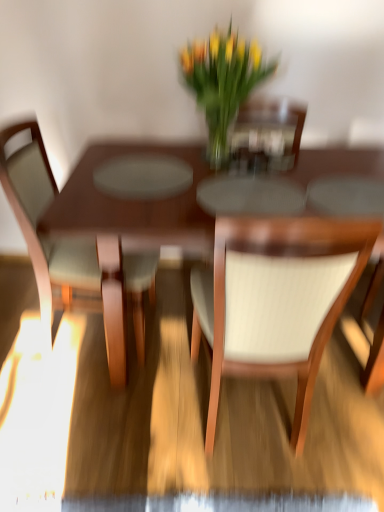
What do you see at coordinates (71, 251) in the screenshot?
I see `light brown wood chair at left, the second chair from the right` at bounding box center [71, 251].

This screenshot has height=512, width=384. I want to click on wooden table at center, so click(128, 227).

Where is `white textured chair at center, the 1th chair in the right-to-left sequence`? Image resolution: width=384 pixels, height=512 pixels. white textured chair at center, the 1th chair in the right-to-left sequence is located at coordinates (276, 300).

Is point (352, 240) less distant than point (154, 282)?

That is True.

Consider the image. From a real-world perspective, which object stands above the other?

light brown wood chair at left, the second chair from the right.

From the image's perspective, is white textured chair at center, the 1th chair in the right-to-left sequence, beneath light brown wood chair at left, the second chair from the right?

Correct, white textured chair at center, the 1th chair in the right-to-left sequence, appears lower than light brown wood chair at left, the second chair from the right, in the image.

Would you say light brown wood chair at left, the second chair from the right, is to the left or to the right of white textured chair at center, which appears as the second chair when viewed from the left, in the picture?

light brown wood chair at left, the second chair from the right, is to the left of white textured chair at center, which appears as the second chair when viewed from the left.

Is light brown wood chair at left, the second chair from the right, further to camera compared to white textured chair at center, which appears as the second chair when viewed from the left?

That is True.

Looking at the image, does light brown wood chair at left, marked as the first chair in a left-to-right arrangement, seem bigger or smaller compared to white textured chair at center, the 1th chair in the right-to-left sequence?

Clearly, light brown wood chair at left, marked as the first chair in a left-to-right arrangement, is larger in size than white textured chair at center, the 1th chair in the right-to-left sequence.

At what (x,y) coordinates should I click in order to perform the action: click on chair in front of the light brown wood chair at left, the second chair from the right. Please return your answer as a coordinate pair (x, y). The image size is (384, 512). Looking at the image, I should click on (276, 300).

From the image's perspective, which is above, translucent glass vase at center or light brown wood chair at left, the second chair from the right?

translucent glass vase at center, from the image's perspective.

From a real-world perspective, is translucent glass vase at center positioned under light brown wood chair at left, the second chair from the right, based on gravity?

No, from a real-world perspective, translucent glass vase at center is not beneath light brown wood chair at left, the second chair from the right.

Is translucent glass vase at center next to light brown wood chair at left, the second chair from the right, and touching it?

No, translucent glass vase at center is not with light brown wood chair at left, the second chair from the right.

Consider the image. Does translucent glass vase at center have a greater height compared to light brown wood chair at left, the second chair from the right?

No.

Can you confirm if wooden table at center is smaller than translucent glass vase at center?

Incorrect, wooden table at center is not smaller in size than translucent glass vase at center.

Considering their positions, is wooden table at center located in front of or behind translucent glass vase at center?

wooden table at center is in front of translucent glass vase at center.

From the image's perspective, is wooden table at center under translucent glass vase at center?

Indeed, from the image's perspective, wooden table at center is shown beneath translucent glass vase at center.

Which of these two, wooden table at center or translucent glass vase at center, is wider?

With larger width is wooden table at center.

Does white textured chair at center, the 1th chair in the right-to-left sequence, have a lesser width compared to wooden table at center?

Yes, white textured chair at center, the 1th chair in the right-to-left sequence, is thinner than wooden table at center.

At what (x,y) coordinates should I click in order to perform the action: click on kitchen & dining room table above the white textured chair at center, the 1th chair in the right-to-left sequence (from the image's perspective). Please return your answer as a coordinate pair (x, y). The width and height of the screenshot is (384, 512). Looking at the image, I should click on (128, 227).

From a real-world perspective, which is physically above, white textured chair at center, which appears as the second chair when viewed from the left, or wooden table at center?

From a 3D spatial view, white textured chair at center, which appears as the second chair when viewed from the left, is above.

Based on the photo, from the image's perspective, is white textured chair at center, which appears as the second chair when viewed from the left, below wooden table at center?

Yes, from the image's perspective, white textured chair at center, which appears as the second chair when viewed from the left, is beneath wooden table at center.

Who is taller, white textured chair at center, the 1th chair in the right-to-left sequence, or translucent glass vase at center?

white textured chair at center, the 1th chair in the right-to-left sequence.

From a real-world perspective, relative to translucent glass vase at center, is white textured chair at center, the 1th chair in the right-to-left sequence, vertically above or below?

white textured chair at center, the 1th chair in the right-to-left sequence, is situated lower than translucent glass vase at center in the real world.

At what (x,y) coordinates should I click in order to perform the action: click on the 2nd chair in front of the translucent glass vase at center, starting your count from the anchor. Please return your answer as a coordinate pair (x, y). Looking at the image, I should click on (276, 300).

Considering the relative sizes of light brown wood chair at left, marked as the first chair in a left-to-right arrangement, and wooden table at center in the image provided, is light brown wood chair at left, marked as the first chair in a left-to-right arrangement, wider than wooden table at center?

No, light brown wood chair at left, marked as the first chair in a left-to-right arrangement, is not wider than wooden table at center.

Is light brown wood chair at left, the second chair from the right, turned away from wooden table at center?

Yes, wooden table at center is at the back of light brown wood chair at left, the second chair from the right.

Considering the relative sizes of light brown wood chair at left, marked as the first chair in a left-to-right arrangement, and wooden table at center in the image provided, is light brown wood chair at left, marked as the first chair in a left-to-right arrangement, smaller than wooden table at center?

Yes, light brown wood chair at left, marked as the first chair in a left-to-right arrangement, is smaller than wooden table at center.

Is point (26, 197) closer or farther from the camera than point (109, 157)?

Point (26, 197) is positioned closer to the camera compared to point (109, 157).

Find the location of a particular element. chair that is below the light brown wood chair at left, the second chair from the right (from the image's perspective) is located at coordinates (276, 300).

The image size is (384, 512). I want to click on chair that appears on the left of white textured chair at center, which appears as the second chair when viewed from the left, so click(71, 251).

From the image, which object appears to be nearer to light brown wood chair at left, marked as the first chair in a left-to-right arrangement, white textured chair at center, which appears as the second chair when viewed from the left, or translucent glass vase at center?

white textured chair at center, which appears as the second chair when viewed from the left, lies closer to light brown wood chair at left, marked as the first chair in a left-to-right arrangement, than the other object.

When comparing their distances from translucent glass vase at center, does light brown wood chair at left, the second chair from the right, or white textured chair at center, the 1th chair in the right-to-left sequence, seem closer?

light brown wood chair at left, the second chair from the right, is closer to translucent glass vase at center.

Which object lies nearer to the anchor point white textured chair at center, the 1th chair in the right-to-left sequence, translucent glass vase at center or light brown wood chair at left, the second chair from the right?

The object closer to white textured chair at center, the 1th chair in the right-to-left sequence, is light brown wood chair at left, the second chair from the right.

Which object lies further to the anchor point translucent glass vase at center, white textured chair at center, which appears as the second chair when viewed from the left, or wooden table at center?

Among the two, white textured chair at center, which appears as the second chair when viewed from the left, is located further to translucent glass vase at center.

Which object lies further to the anchor point white textured chair at center, the 1th chair in the right-to-left sequence, wooden table at center or translucent glass vase at center?

Based on the image, translucent glass vase at center appears to be further to white textured chair at center, the 1th chair in the right-to-left sequence.

Considering their positions, is wooden table at center positioned further to translucent glass vase at center than white textured chair at center, the 1th chair in the right-to-left sequence?

Based on the image, white textured chair at center, the 1th chair in the right-to-left sequence, appears to be further to translucent glass vase at center.

Considering their positions, is wooden table at center positioned further to translucent glass vase at center than light brown wood chair at left, the second chair from the right?

light brown wood chair at left, the second chair from the right.

Estimate the real-world distances between objects in this image. Which object is closer to light brown wood chair at left, the second chair from the right, wooden table at center or white textured chair at center, the 1th chair in the right-to-left sequence?

wooden table at center is positioned closer to the anchor light brown wood chair at left, the second chair from the right.

The height and width of the screenshot is (512, 384). In order to click on chair between translucent glass vase at center and white textured chair at center, the 1th chair in the right-to-left sequence, vertically in this screenshot , I will do `click(71, 251)`.

Image resolution: width=384 pixels, height=512 pixels. In order to click on kitchen & dining room table situated between light brown wood chair at left, the second chair from the right, and white textured chair at center, the 1th chair in the right-to-left sequence, from left to right in this screenshot , I will do `click(128, 227)`.

You are a GUI agent. You are given a task and a screenshot of the screen. Output one action in this format:
    pyautogui.click(x=<x>, y=<y>)
    Task: Click on the kitchen & dining room table that lies between translucent glass vase at center and white textured chair at center, which appears as the second chair when viewed from the left, from top to bottom
    
    Given the screenshot: What is the action you would take?
    point(128,227)

At what (x,y) coordinates should I click in order to perform the action: click on chair that lies between translucent glass vase at center and wooden table at center from top to bottom. Please return your answer as a coordinate pair (x, y). The height and width of the screenshot is (512, 384). Looking at the image, I should click on (71, 251).